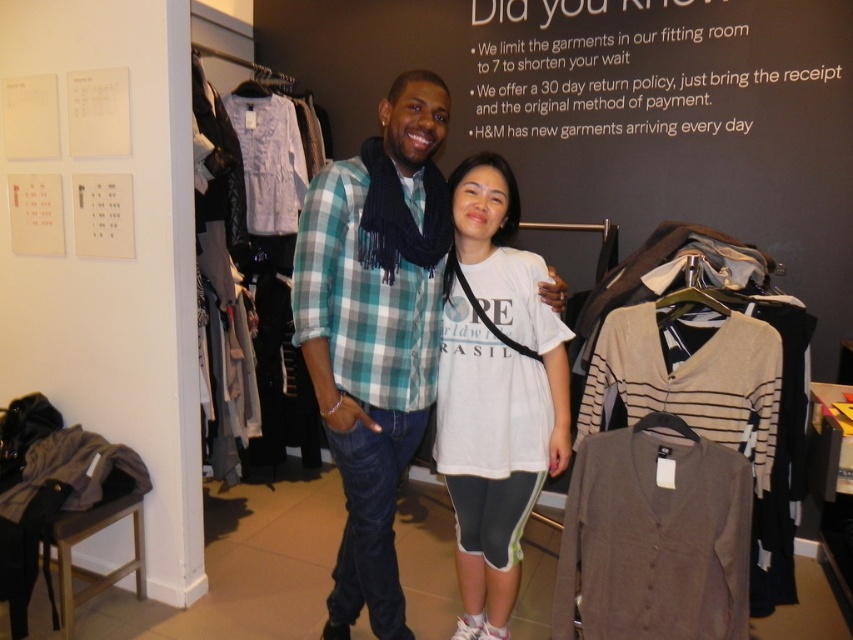
You are standing at the entrance of the clothing store and want to take a photo of the point at coordinates [320,180]. The camera you are using has a maximum focus range of 5 feet. Will the camera be able to focus on the point?

The distance of point [320,180] from the camera is 5.68 feet, which exceeds the camera maximum focus range of 5 feet. Therefore, the camera will not be able to focus on the point.

You are a customer in the store and want to choose between the matte blue plaid shirt at center and the dark gray knit cardigan at center. Which one is taller?

The matte blue plaid shirt at center is taller than the dark gray knit cardigan at center.